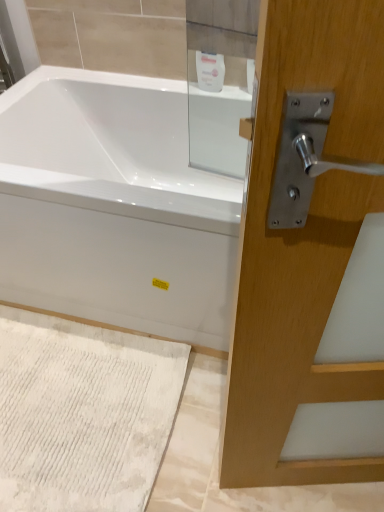
Question: Is white glossy soap dispenser at upper center in front of white glossy bathtub at center?

Choices:
 (A) yes
 (B) no

Answer: (B)

Question: From the image's perspective, does white glossy soap dispenser at upper center appear lower than white glossy bathtub at center?

Choices:
 (A) yes
 (B) no

Answer: (B)

Question: Is white glossy soap dispenser at upper center outside white glossy bathtub at center?

Choices:
 (A) no
 (B) yes

Answer: (B)

Question: Is white glossy soap dispenser at upper center to the right of white glossy bathtub at center from the viewer's perspective?

Choices:
 (A) yes
 (B) no

Answer: (A)

Question: From a real-world perspective, is white glossy soap dispenser at upper center positioned over white glossy bathtub at center based on gravity?

Choices:
 (A) no
 (B) yes

Answer: (B)

Question: Does white glossy soap dispenser at upper center lie behind white glossy bathtub at center?

Choices:
 (A) no
 (B) yes

Answer: (B)

Question: Can you confirm if white glossy soap dispenser at upper center is wider than white textured bath mat at lower left?

Choices:
 (A) no
 (B) yes

Answer: (A)

Question: Is white glossy soap dispenser at upper center outside of white textured bath mat at lower left?

Choices:
 (A) no
 (B) yes

Answer: (B)

Question: Is white glossy soap dispenser at upper center positioned before white textured bath mat at lower left?

Choices:
 (A) yes
 (B) no

Answer: (B)

Question: Does white glossy soap dispenser at upper center have a smaller size compared to white textured bath mat at lower left?

Choices:
 (A) yes
 (B) no

Answer: (A)

Question: Can white textured bath mat at lower left be found inside white glossy soap dispenser at upper center?

Choices:
 (A) no
 (B) yes

Answer: (A)

Question: Does white glossy soap dispenser at upper center have a greater height compared to white textured bath mat at lower left?

Choices:
 (A) no
 (B) yes

Answer: (B)

Question: Is white textured bath mat at lower left positioned behind white glossy soap dispenser at upper center?

Choices:
 (A) no
 (B) yes

Answer: (A)